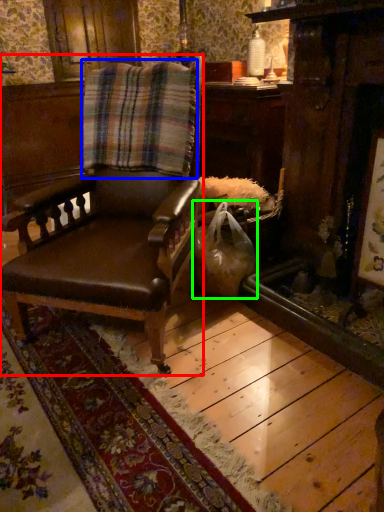
Question: Considering the real-world distances, which object is farthest from chair (highlighted by a red box)? blanket (highlighted by a blue box) or shopping bag (highlighted by a green box)?

Choices:
 (A) blanket
 (B) shopping bag

Answer: (B)